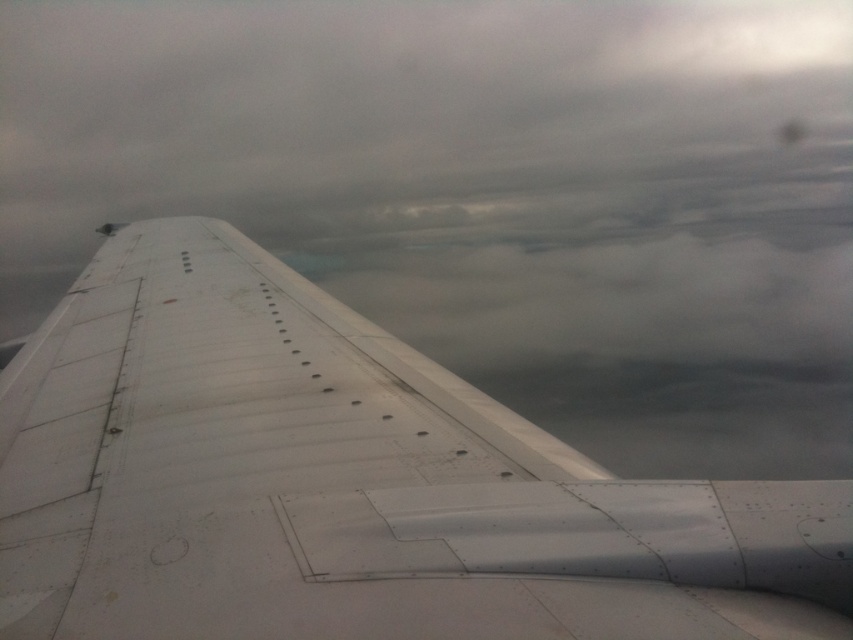
Is white matte wing at center smaller than metallic white wing at center?

No, white matte wing at center is not smaller than metallic white wing at center.

How much distance is there between white matte wing at center and metallic white wing at center?

They are 13.14 meters apart.

Does point (471, 256) come behind point (480, 452)?

That is True.

At what (x,y) coordinates should I click in order to perform the action: click on white matte wing at center. Please return your answer as a coordinate pair (x, y). The image size is (853, 640). Looking at the image, I should click on (485, 193).